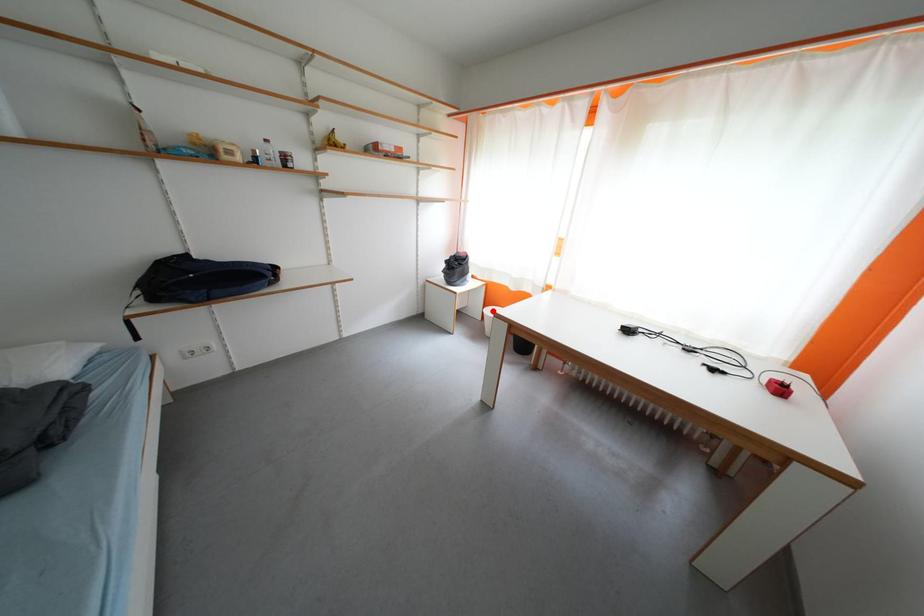
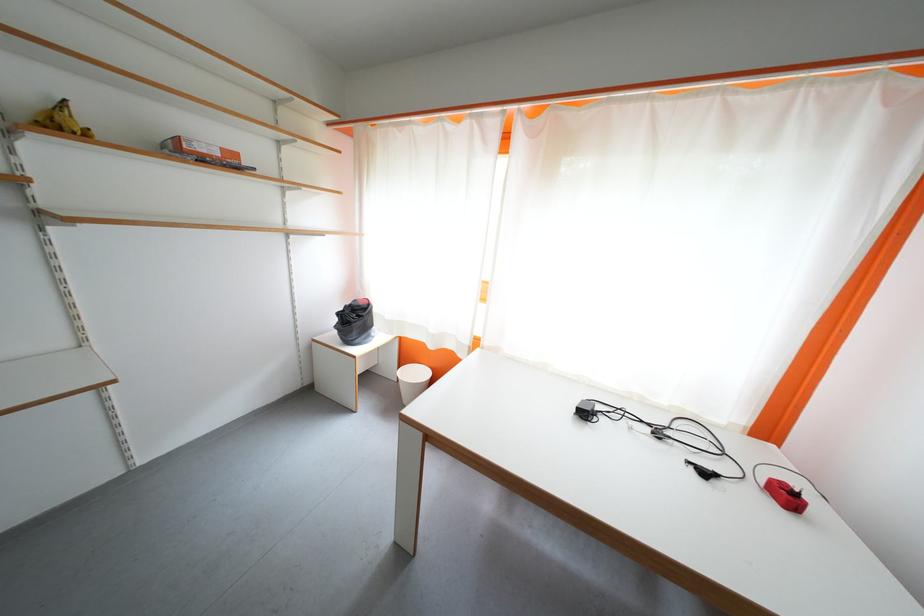
The point at the highlighted location is marked in the first image. Where is the corresponding point in the second image?

(407, 370)